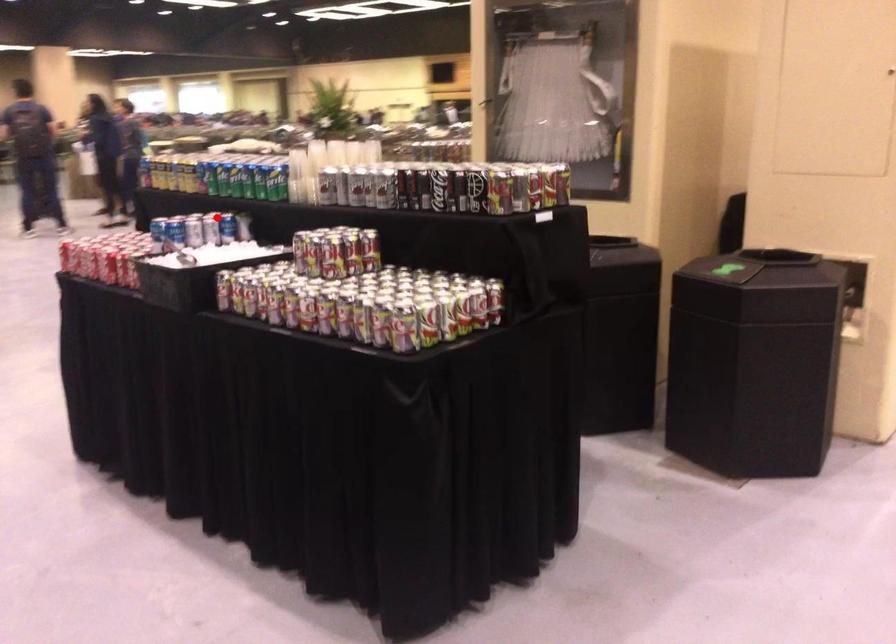
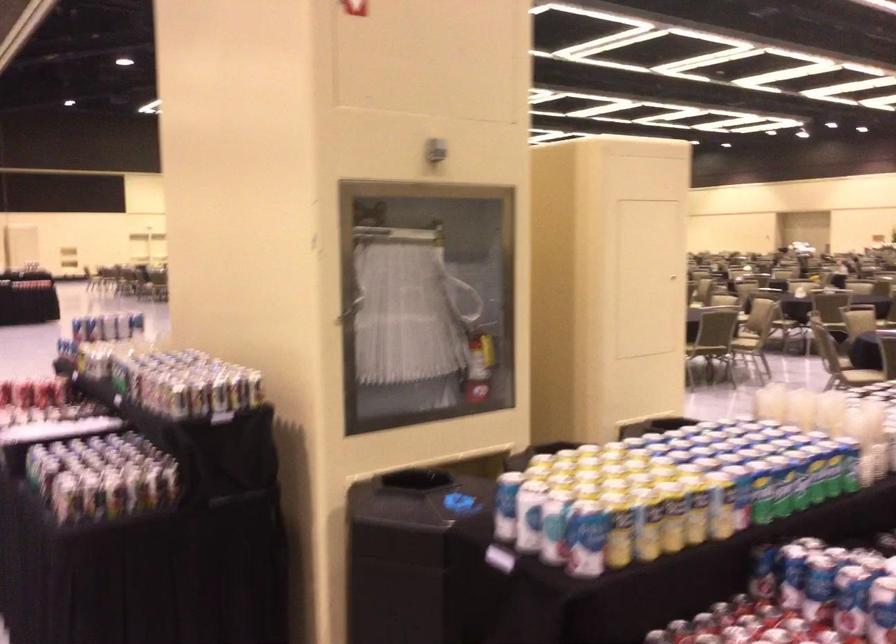
Where in the second image is the point corresponding to the highlighted location from the first image?

(762, 572)